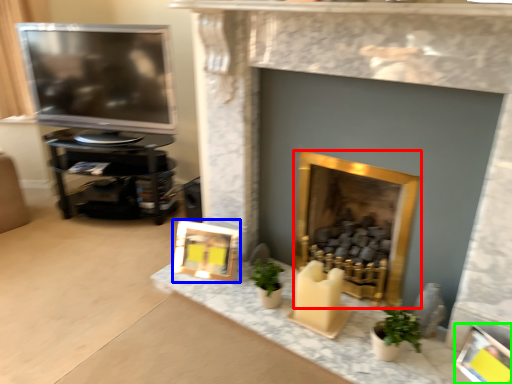
Question: Which object is positioned closest to fireplace (highlighted by a red box)? Select from picture frame (highlighted by a blue box) and picture frame (highlighted by a green box).

Choices:
 (A) picture frame
 (B) picture frame

Answer: (A)